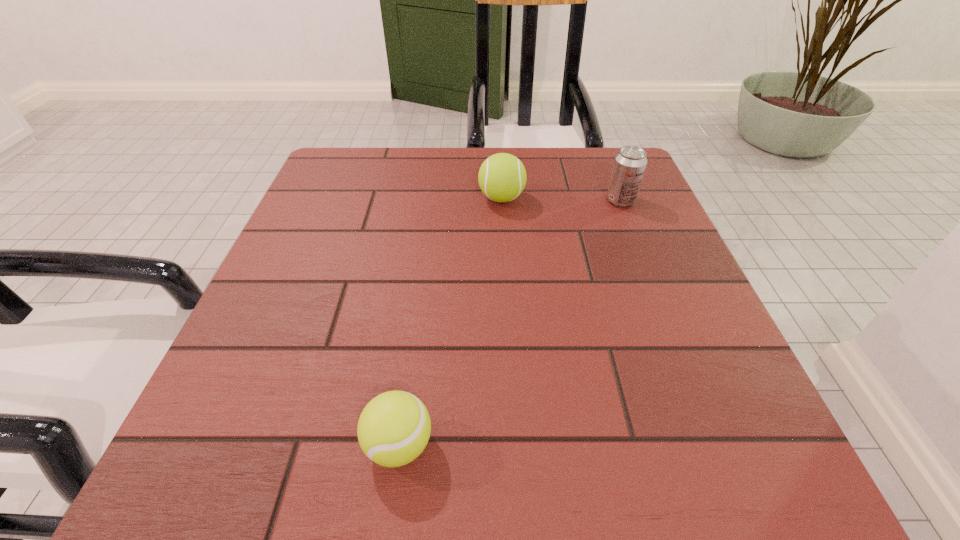
In order to click on vacant space at the near right corner of the desktop in this screenshot , I will do `click(722, 450)`.

Where is `free space between the left tennis ball and the rightmost object`? The image size is (960, 540). free space between the left tennis ball and the rightmost object is located at coordinates (510, 323).

The height and width of the screenshot is (540, 960). In order to click on free area in between the rightmost object and the shorter tennis ball in this screenshot , I will do `click(510, 323)`.

Identify the location of free point between the right tennis ball and the shorter tennis ball. The width and height of the screenshot is (960, 540). (450, 321).

Where is `blank region between the second object from left to right and the shorter tennis ball`? Image resolution: width=960 pixels, height=540 pixels. blank region between the second object from left to right and the shorter tennis ball is located at coordinates (450, 321).

Locate an element on the screen. free space between the beer can and the right tennis ball is located at coordinates (562, 199).

Image resolution: width=960 pixels, height=540 pixels. In order to click on unoccupied area between the beer can and the second object from right to left in this screenshot , I will do `click(562, 199)`.

Where is `vacant area between the beer can and the nearest object`? The width and height of the screenshot is (960, 540). vacant area between the beer can and the nearest object is located at coordinates (510, 323).

Find the location of `free space between the nearest object and the beer can`. free space between the nearest object and the beer can is located at coordinates (510, 323).

The height and width of the screenshot is (540, 960). I want to click on free point between the left tennis ball and the beer can, so click(x=510, y=323).